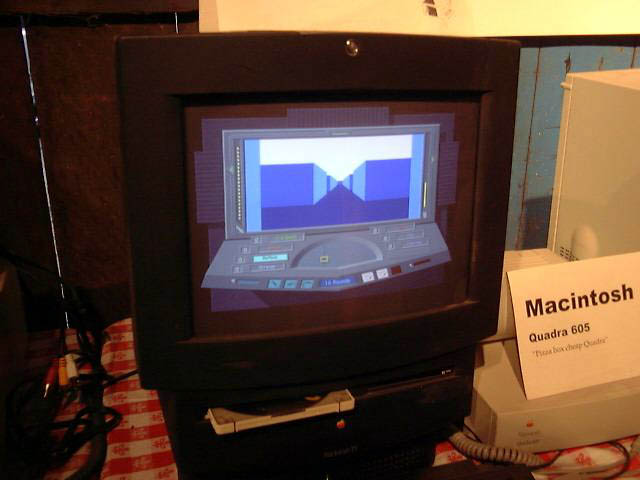
Identify the location of cd case. The image size is (640, 480). (235, 423).